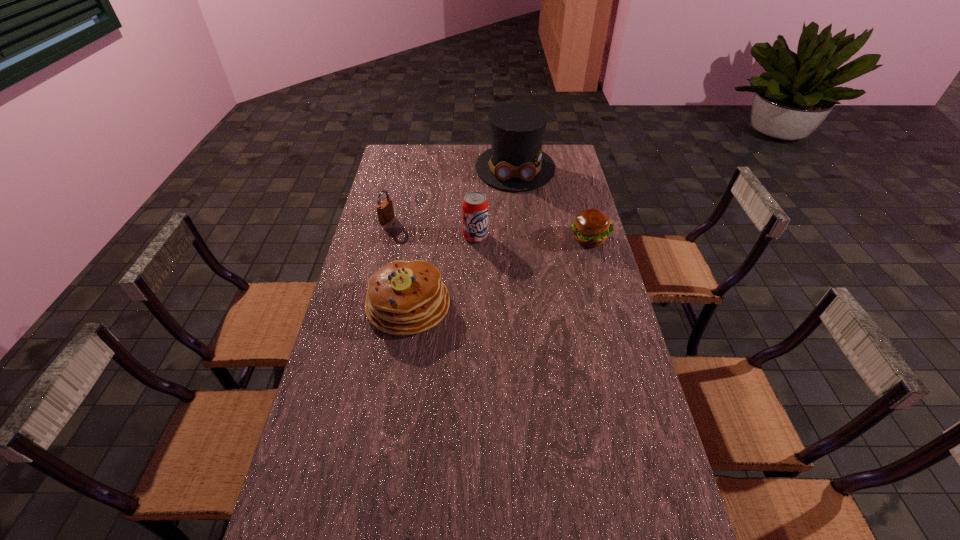
Identify the location of free point between the pancake and the farthest object. This screenshot has height=540, width=960. (462, 237).

The height and width of the screenshot is (540, 960). Identify the location of free space between the soda can and the padlock. (431, 228).

Where is `free space between the soda can and the pancake`? The height and width of the screenshot is (540, 960). free space between the soda can and the pancake is located at coordinates (442, 271).

This screenshot has height=540, width=960. Find the location of `free space between the tallest object and the nearest object`. free space between the tallest object and the nearest object is located at coordinates (462, 237).

This screenshot has height=540, width=960. I want to click on vacant area that lies between the dress hat and the hamburger, so click(x=552, y=203).

Image resolution: width=960 pixels, height=540 pixels. Identify the location of object that ranks as the closest to the dress hat. 591,227.

Locate which object ranks fourth in proximity to the padlock. Please provide its 2D coordinates. Your answer should be formatted as a tuple, i.e. [(x, y)], where the tuple contains the x and y coordinates of a point satisfying the conditions above.

[(591, 227)]

This screenshot has width=960, height=540. What are the coordinates of `free space that satisfies the following two spatial constraints: 1. on the front side of the padlock; 2. on the right side of the hamburger` in the screenshot? It's located at (383, 239).

The image size is (960, 540). Identify the location of free location that satisfies the following two spatial constraints: 1. on the back side of the nearest object; 2. on the left side of the second tallest object. (419, 237).

This screenshot has height=540, width=960. What are the coordinates of `vacant position in the image that satisfies the following two spatial constraints: 1. on the front side of the second farthest object; 2. on the left side of the soda can` in the screenshot? It's located at (383, 237).